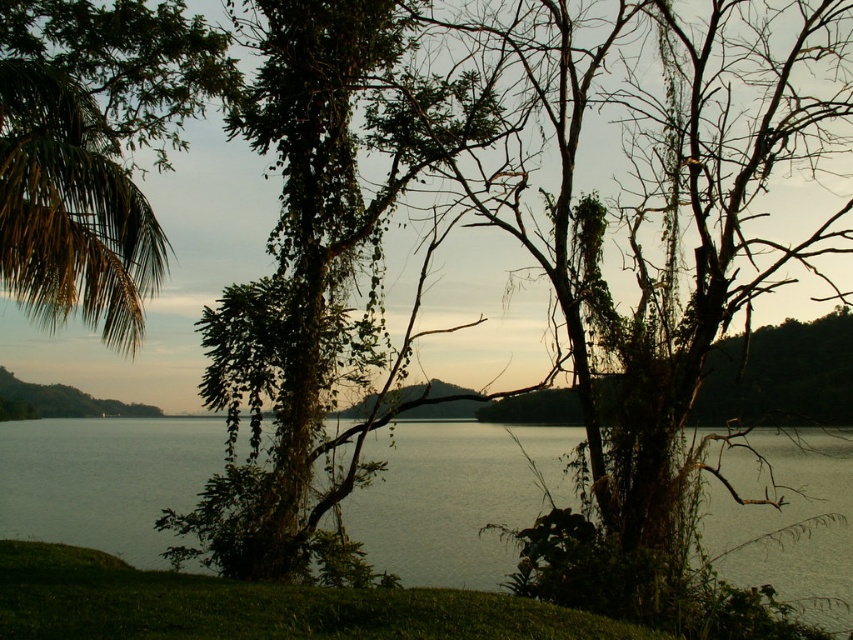
You are standing at the lakeside and want to take a photo of both the greenish water at center and the green leafy palm at upper left. Which object should you focus on first to ensure both are in sharp focus?

You should focus on the green leafy palm at upper left first because it is farther away from the viewer than the greenish water at center. By focusing on the farther object, you can ensure that both will be in focus due to the depth of field.

You are standing on the lakeside and want to take a photo of the greenish water at center and the green leafy palm at upper left. Which object is closer to the camera based on their positions in the image?

The green leafy palm at upper left is closer to the camera than the greenish water at center because objects higher in the image are typically closer to the viewer.